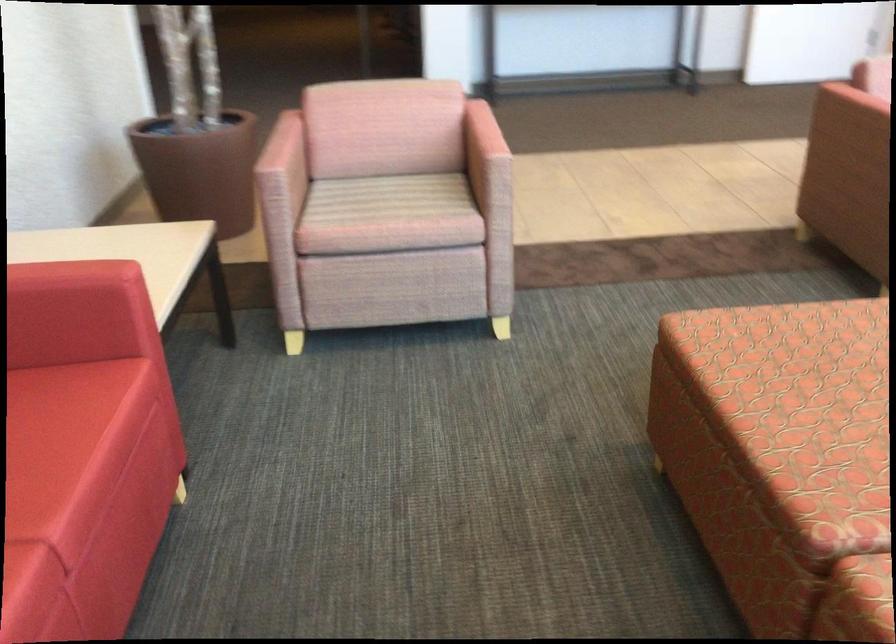
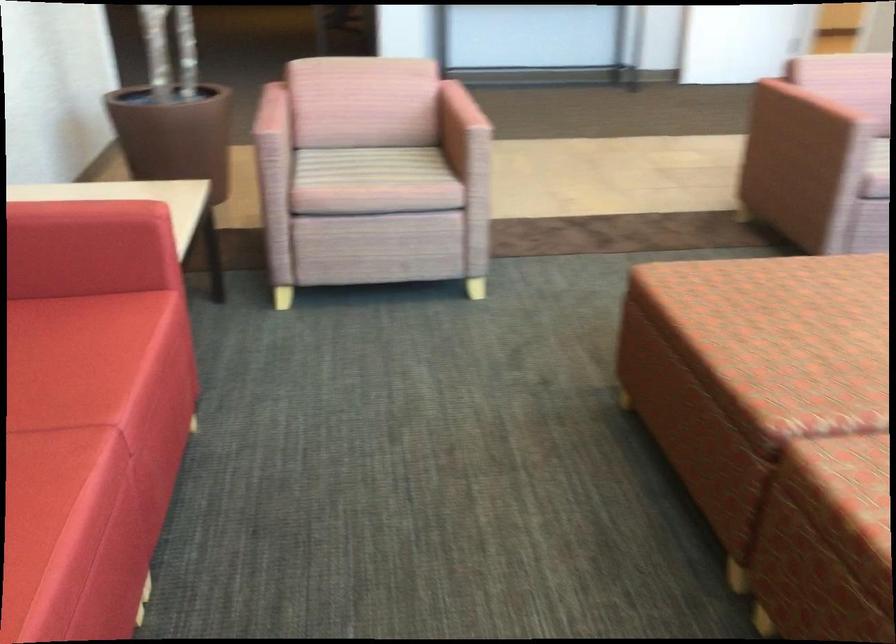
Find the pixel in the second image that matches point (278, 147) in the first image.

(271, 113)